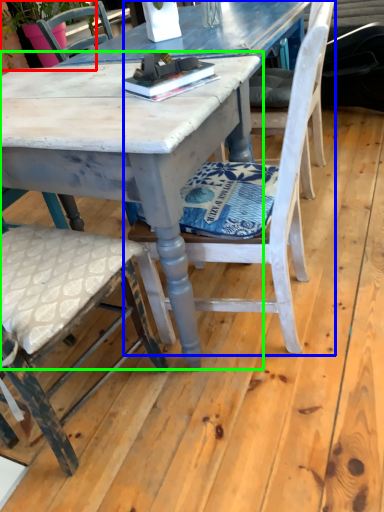
Question: Based on their relative distances, which object is farther from plant (highlighted by a red box)? Choose from chair (highlighted by a blue box) and round table (highlighted by a green box).

Choices:
 (A) chair
 (B) round table

Answer: (A)